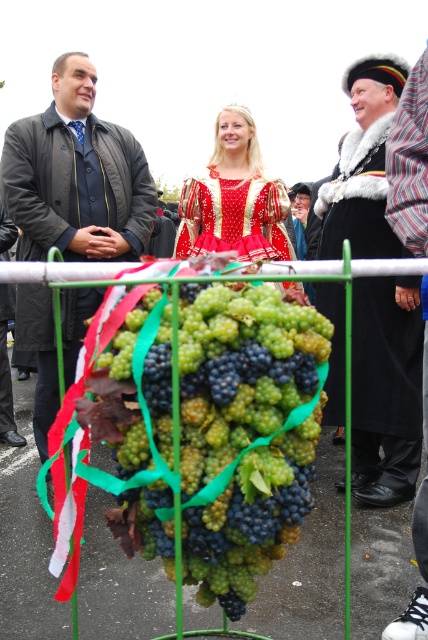
Who is shorter, green matte grapes at center or matte black coat at left?

green matte grapes at center

Does green matte grapes at center appear on the left side of matte black coat at left?

No, green matte grapes at center is not to the left of matte black coat at left.

Is point (253, 353) behind point (53, 132)?

No.

Where is `green matte grapes at center`? This screenshot has width=428, height=640. green matte grapes at center is located at coordinates (246, 442).

Between matte black coat at left and striped shirt at right, which one appears on the right side from the viewer's perspective?

striped shirt at right

Does matte black coat at left have a lesser width compared to striped shirt at right?

No.

Is point (95, 84) behind point (413, 516)?

Yes.

In order to click on matte black coat at left in this screenshot , I will do `click(77, 176)`.

Can you confirm if matte black coat at left is bigger than shiny red dress at center?

Yes.

Can you confirm if matte black coat at left is shorter than shiny red dress at center?

No.

Describe the element at coordinates (77, 176) in the screenshot. I see `matte black coat at left` at that location.

Image resolution: width=428 pixels, height=640 pixels. In order to click on matte black coat at left in this screenshot , I will do `click(77, 176)`.